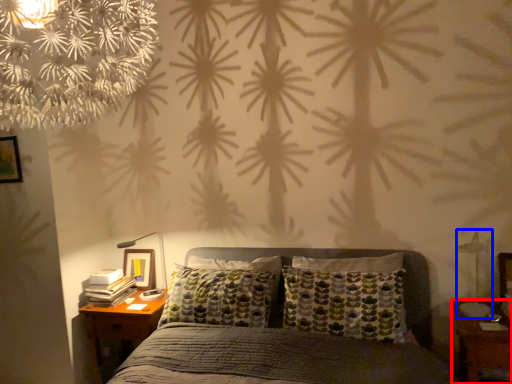
Question: Which point is closer to the camera, nightstand (highlighted by a red box) or bedside lamp (highlighted by a blue box)?

Choices:
 (A) nightstand
 (B) bedside lamp

Answer: (A)